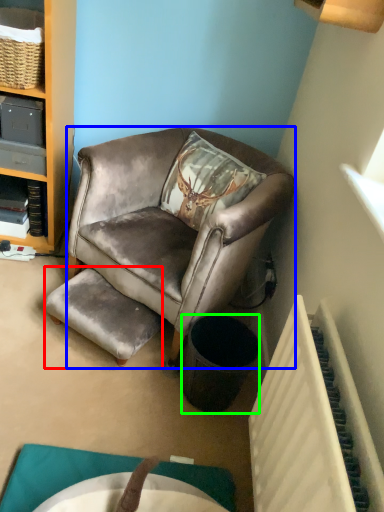
Question: Considering the real-world distances, which object is closest to stool (highlighted by a red box)? chair (highlighted by a blue box) or trash bin/can (highlighted by a green box).

Choices:
 (A) chair
 (B) trash bin/can

Answer: (A)